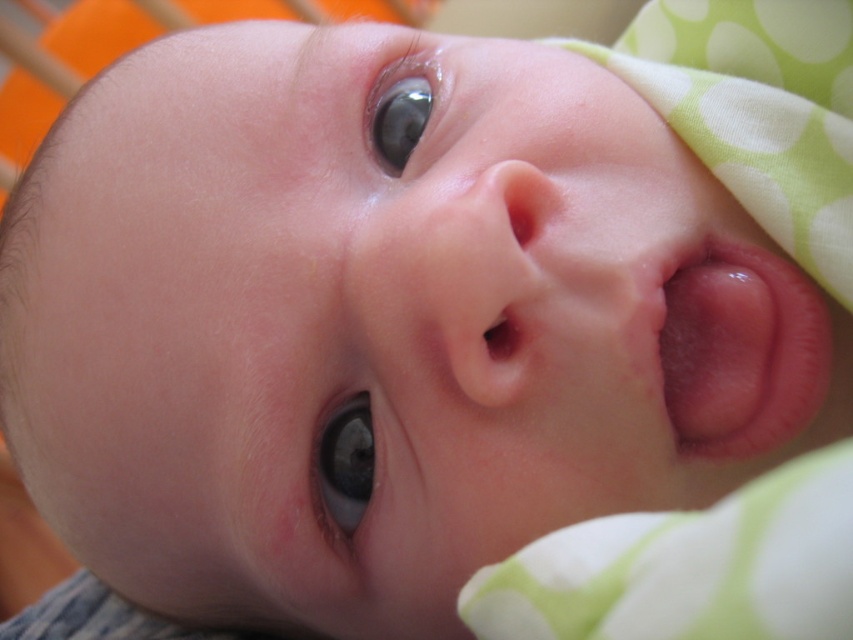
Question: Which point is closer to the camera taking this photo?

Choices:
 (A) (357, 401)
 (B) (751, 371)
 (C) (474, 198)
 (D) (437, 97)

Answer: (C)

Question: Which point is closer to the camera?

Choices:
 (A) smooth flesh-colored nose at center
 (B) glossy blue eye at upper center
 (C) blue glossy eye at center
 (D) pink smooth tongue at center

Answer: (A)

Question: Does glossy blue eye at upper center appear over blue glossy eye at center?

Choices:
 (A) yes
 (B) no

Answer: (A)

Question: Among these points, which one is nearest to the camera?

Choices:
 (A) (741, 442)
 (B) (531, 180)
 (C) (376, 88)

Answer: (B)

Question: Does smooth flesh-colored nose at center have a larger size compared to glossy blue eye at upper center?

Choices:
 (A) no
 (B) yes

Answer: (B)

Question: Can you confirm if glossy blue eye at upper center is positioned below blue glossy eye at center?

Choices:
 (A) no
 (B) yes

Answer: (A)